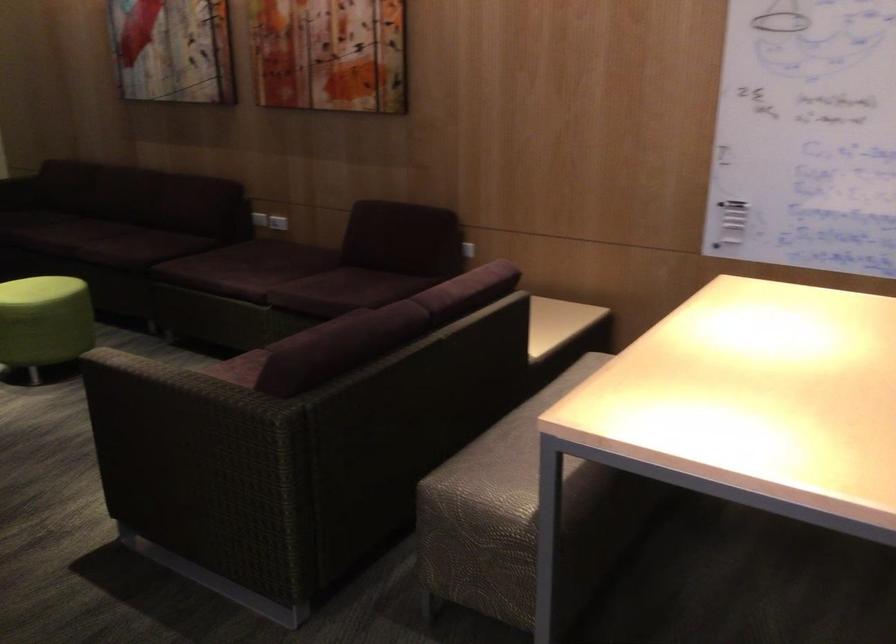
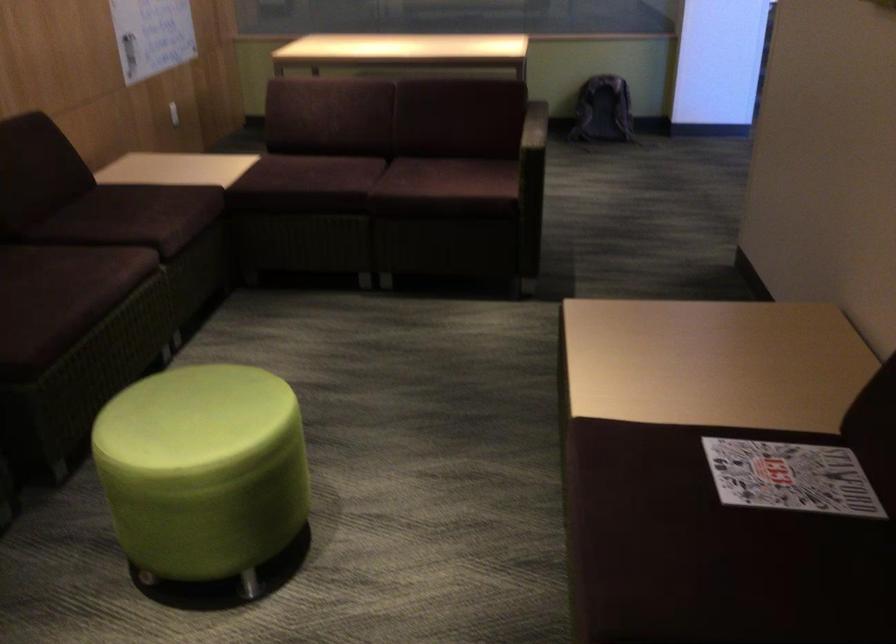
Locate, in the second image, the point that corresponds to pixel 210 267 in the first image.

(44, 301)